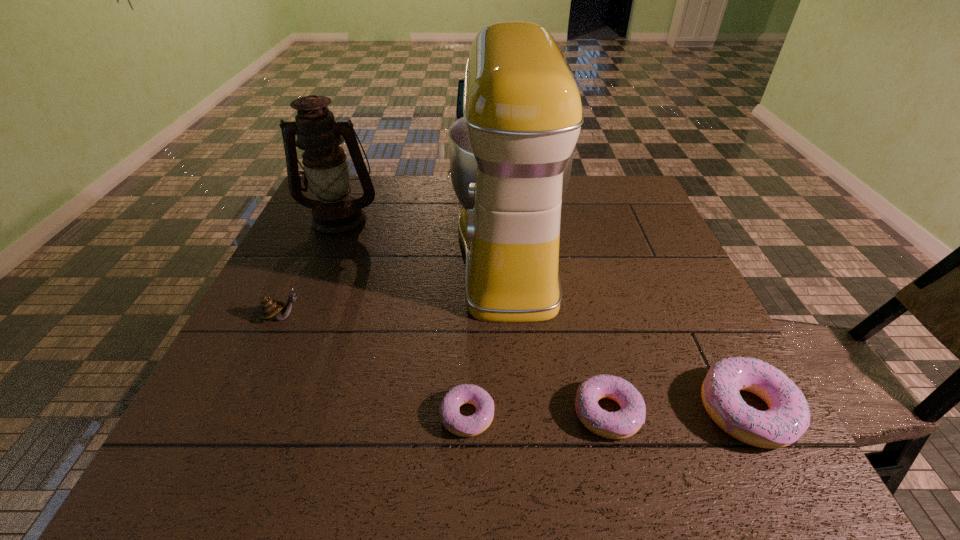
This screenshot has height=540, width=960. Identify the location of vacant space located 0.070m on the left of the second shortest doughnut. pyautogui.click(x=536, y=413).

The image size is (960, 540). I want to click on free point located on the back of the tallest doughnut, so click(672, 267).

You are a GUI agent. You are given a task and a screenshot of the screen. Output one action in this format:
    pyautogui.click(x=<x>, y=<y>)
    Task: Click on the vacant area located on the side of the tallest object with the control knob
    This screenshot has height=540, width=960.
    Given the screenshot: What is the action you would take?
    pyautogui.click(x=327, y=253)

The height and width of the screenshot is (540, 960). What are the coordinates of `vacant space located 0.310m on the side of the tallest object with the control knob` in the screenshot? It's located at click(x=335, y=253).

Where is `vacant space situated 0.170m on the side of the tallest object with the control knob`? This screenshot has width=960, height=540. vacant space situated 0.170m on the side of the tallest object with the control knob is located at coordinates (388, 253).

I want to click on free region located on the front of the lantern, so (x=315, y=280).

I want to click on vacant space located 0.400m on the face of the snail, so click(482, 316).

The height and width of the screenshot is (540, 960). I want to click on mixer that is positioned at the far edge, so click(511, 154).

Find the location of `lantern located at the far edge`. lantern located at the far edge is located at coordinates (335, 214).

Where is `lantern positioned at the left edge`? The width and height of the screenshot is (960, 540). lantern positioned at the left edge is located at coordinates (335, 214).